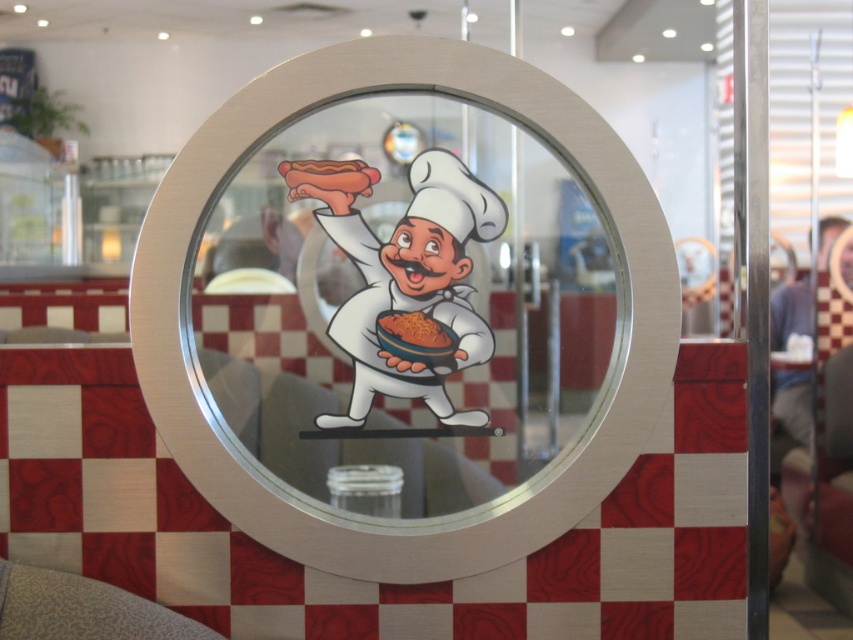
Question: Can you confirm if matte glass sign at center is positioned above brown matte spaghetti at center?

Choices:
 (A) yes
 (B) no

Answer: (A)

Question: Which object appears closest to the camera in this image?

Choices:
 (A) matte hot dog at upper center
 (B) matte glass sign at center

Answer: (B)

Question: Does matte glass sign at center appear over matte hot dog at upper center?

Choices:
 (A) yes
 (B) no

Answer: (B)

Question: Which object is farther from the camera taking this photo?

Choices:
 (A) brown matte spaghetti at center
 (B) matte glass sign at center
 (C) matte hot dog at upper center

Answer: (A)

Question: Is matte glass sign at center to the right of brown matte spaghetti at center from the viewer's perspective?

Choices:
 (A) yes
 (B) no

Answer: (B)

Question: Which point is closer to the camera taking this photo?

Choices:
 (A) (320, 211)
 (B) (302, 164)
 (C) (405, 340)

Answer: (B)